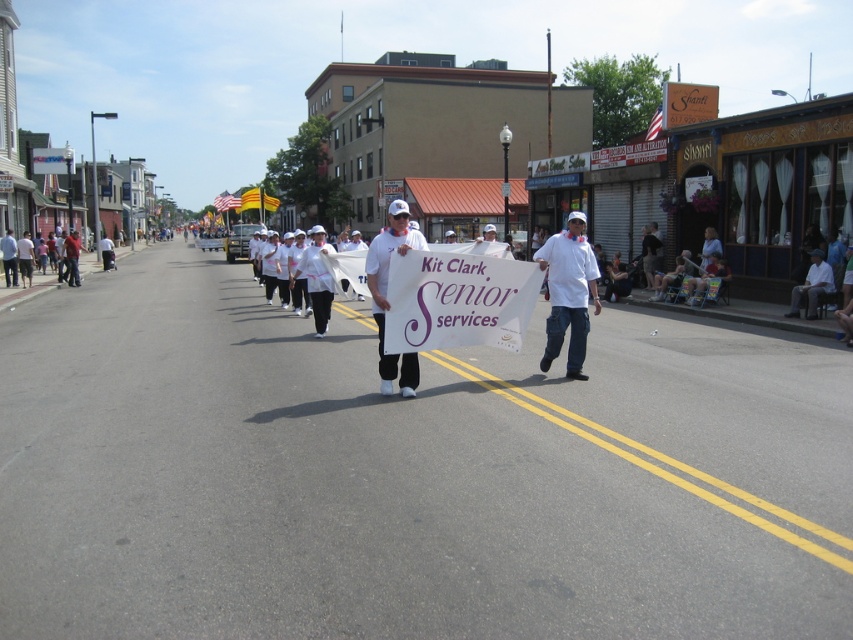
How much distance is there between white fabric uniform at center and white fabric at center?

white fabric uniform at center and white fabric at center are 27.63 meters apart from each other.

Does white fabric uniform at center have a lesser height compared to white fabric at center?

Indeed, white fabric uniform at center has a lesser height compared to white fabric at center.

Is point (312, 316) farther from camera compared to point (102, 241)?

No, it is not.

The height and width of the screenshot is (640, 853). Find the location of `white fabric uniform at center`. white fabric uniform at center is located at coordinates (316, 278).

Does white chef hat at center have a lesser width compared to white fabric at right?

No, white chef hat at center is not thinner than white fabric at right.

At what (x,y) coordinates should I click in order to perform the action: click on white chef hat at center. Please return your answer as a coordinate pair (x, y). Image resolution: width=853 pixels, height=640 pixels. Looking at the image, I should click on (567, 292).

Is the position of white matte sign at center less distant than that of white fabric at right?

Yes.

From the picture: Is white matte sign at center below white fabric at right?

Indeed, white matte sign at center is positioned under white fabric at right.

This screenshot has width=853, height=640. Find the location of `white matte sign at center`. white matte sign at center is located at coordinates (387, 276).